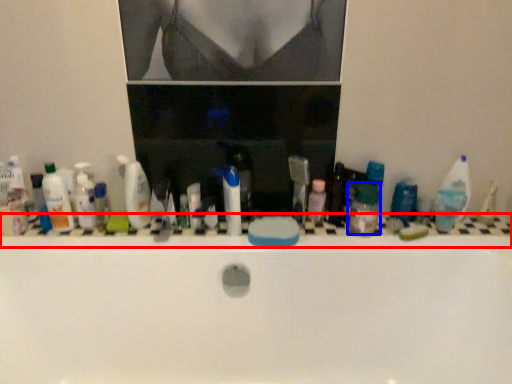
Question: Which object appears farthest to the camera in this image, ledge (highlighted by a red box) or mouthwash (highlighted by a blue box)?

Choices:
 (A) ledge
 (B) mouthwash

Answer: (A)